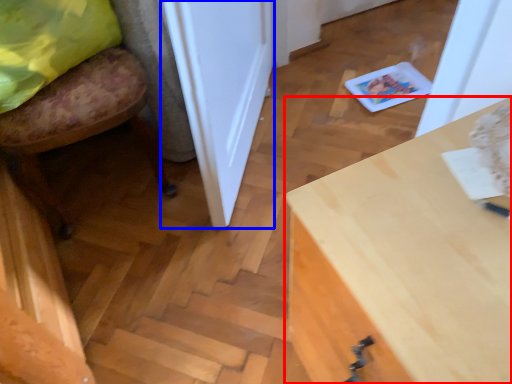
Question: Which object is further to the camera taking this photo, desk (highlighted by a red box) or door (highlighted by a blue box)?

Choices:
 (A) desk
 (B) door

Answer: (B)